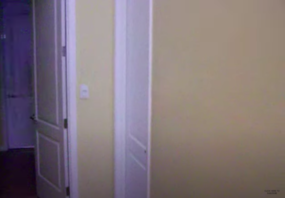
Locate an element on the screen. Image resolution: width=285 pixels, height=198 pixels. door hinges is located at coordinates (65, 52), (66, 121), (67, 187).